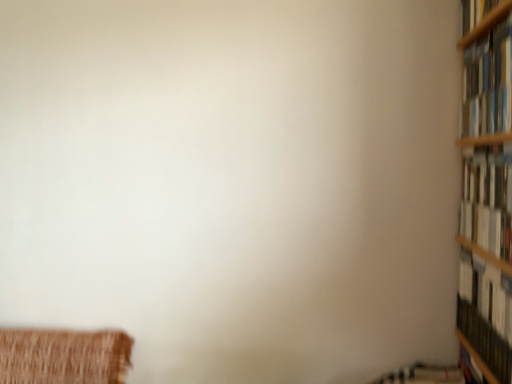
Question: Is hardcover book at right, the third book when ordered from top to bottom, positioned beyond the bounds of hardcover books at upper right, which is counted as the first book, starting from the top?

Choices:
 (A) yes
 (B) no

Answer: (A)

Question: Can you confirm if hardcover book at right, the third book when ordered from top to bottom, is bigger than hardcover books at upper right, which is counted as the first book, starting from the top?

Choices:
 (A) no
 (B) yes

Answer: (A)

Question: Is hardcover book at right, the third book when ordered from top to bottom, smaller than hardcover books at upper right, the third book positioned from the bottom?

Choices:
 (A) yes
 (B) no

Answer: (A)

Question: Can you confirm if hardcover book at right, the third book when ordered from top to bottom, is positioned to the right of hardcover books at upper right, the third book positioned from the bottom?

Choices:
 (A) no
 (B) yes

Answer: (B)

Question: Could you tell me if hardcover book at right, acting as the first book starting from the bottom, is turned towards hardcover books at upper right, which is counted as the first book, starting from the top?

Choices:
 (A) no
 (B) yes

Answer: (A)

Question: Is hardcover book at right, the third book when ordered from top to bottom, looking in the opposite direction of hardcover books at upper right, which is counted as the first book, starting from the top?

Choices:
 (A) yes
 (B) no

Answer: (B)

Question: Considering the relative sizes of hardcover books at upper right, the third book positioned from the bottom, and white paper book at right, the second book from the top, in the image provided, is hardcover books at upper right, the third book positioned from the bottom, wider than white paper book at right, the second book from the top,?

Choices:
 (A) no
 (B) yes

Answer: (B)

Question: From the image's perspective, is hardcover books at upper right, which is counted as the first book, starting from the top, over white paper book at right, the second book from the top?

Choices:
 (A) no
 (B) yes

Answer: (B)

Question: Is white paper book at right, the 2th book from the bottom, completely or partially inside hardcover books at upper right, which is counted as the first book, starting from the top?

Choices:
 (A) no
 (B) yes

Answer: (A)

Question: Can you confirm if hardcover books at upper right, which is counted as the first book, starting from the top, is positioned to the right of white paper book at right, the 2th book from the bottom?

Choices:
 (A) yes
 (B) no

Answer: (B)

Question: Can we say hardcover books at upper right, the third book positioned from the bottom, lies outside white paper book at right, the 2th book from the bottom?

Choices:
 (A) no
 (B) yes

Answer: (B)

Question: Is hardcover books at upper right, which is counted as the first book, starting from the top, thinner than white paper book at right, the 2th book from the bottom?

Choices:
 (A) no
 (B) yes

Answer: (A)

Question: From the image's perspective, is white paper book at right, the second book from the top, on hardcover book at right, the third book when ordered from top to bottom?

Choices:
 (A) no
 (B) yes

Answer: (B)